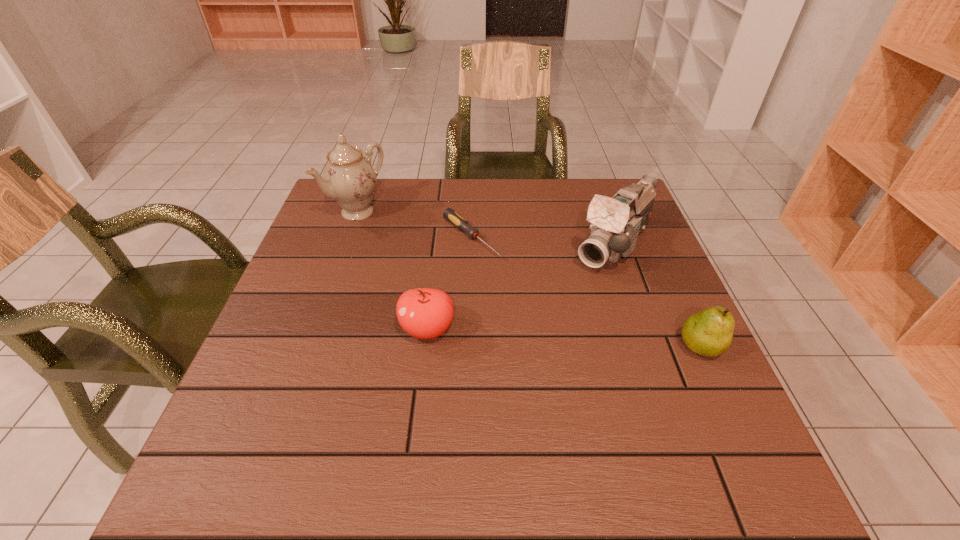
The height and width of the screenshot is (540, 960). I want to click on object that is at the left edge, so click(x=349, y=178).

Image resolution: width=960 pixels, height=540 pixels. Find the location of `pear that is positioned at the right edge`. pear that is positioned at the right edge is located at coordinates (709, 332).

This screenshot has height=540, width=960. Identify the location of camcorder situated at the right edge. (617, 222).

Image resolution: width=960 pixels, height=540 pixels. Identify the location of object positioned at the far left corner. (349, 178).

In order to click on object at the far right corner in this screenshot , I will do `click(617, 222)`.

The width and height of the screenshot is (960, 540). I want to click on free spot at the far edge of the desktop, so tap(552, 209).

In order to click on vacant area at the left edge of the desktop in this screenshot , I will do `click(311, 271)`.

Locate an element on the screen. This screenshot has height=540, width=960. free space at the right edge is located at coordinates (659, 284).

In the image, there is a desktop. Identify the location of vacant region at the near right corner. (714, 429).

Identify the location of free space that is in between the leftmost object and the camcorder. Image resolution: width=960 pixels, height=540 pixels. (486, 228).